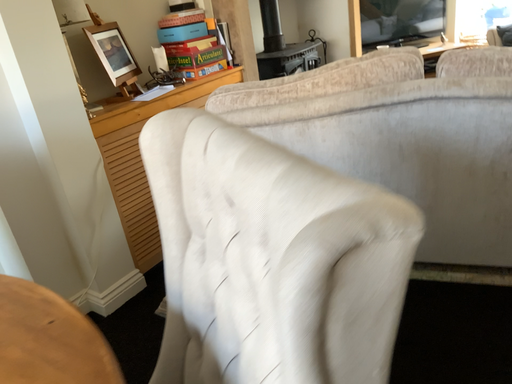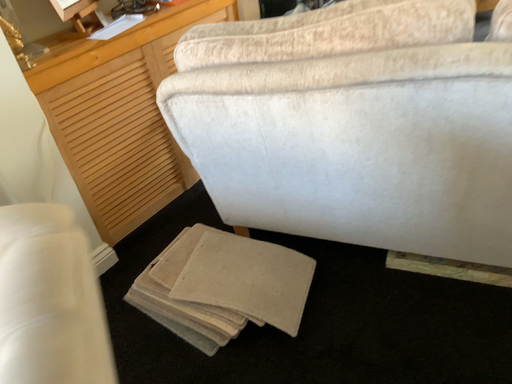
Question: Which way did the camera rotate in the video?

Choices:
 (A) rotated upward
 (B) rotated downward

Answer: (B)